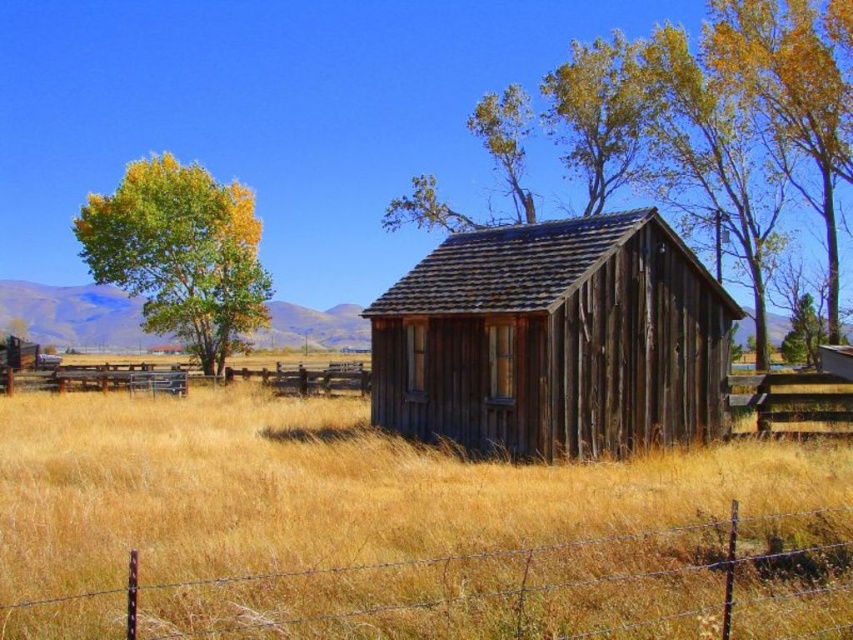
You are planning to plant a new tree in the field near the cabin. You have two options from the image, the yellow leafy tree at upper right and the green rough bark tree at center. Which tree would cast a larger shadow at noon based on their sizes?

The yellow leafy tree at upper right is much taller than the green rough bark tree at center, so it would cast a larger shadow at noon.